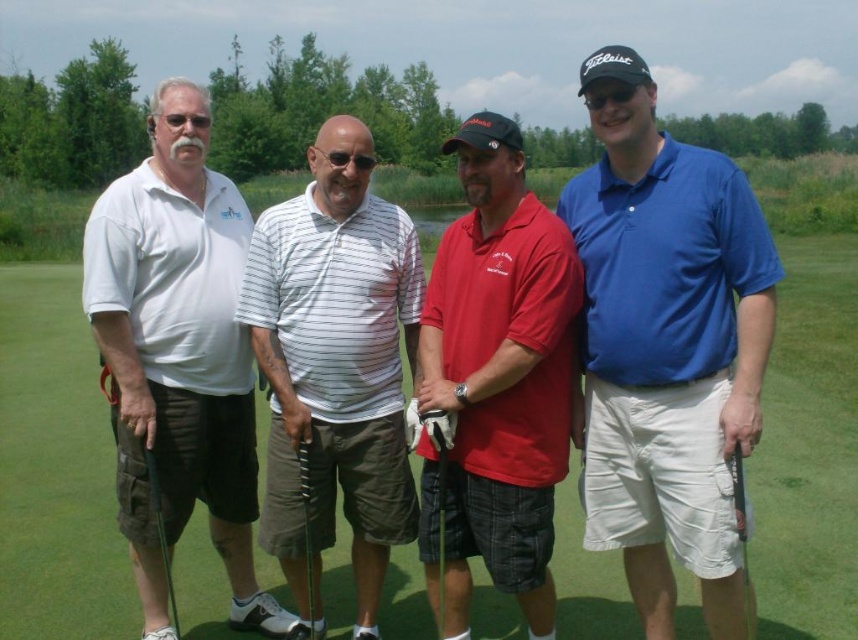
Based on the photo, you are a photographer trying to capture a closeup shot of the blue cotton polo shirt at center and the black metallic golf club at center. Which object should you zoom in on more to ensure both are in focus?

The blue cotton polo shirt at center is bigger than the black metallic golf club at center, so you should zoom in more on the black metallic golf club at center to ensure both are in focus.

You are a photographer trying to capture a clear shot of the blue cotton polo shirt at center and the black metallic golf club at center. Based on their positions, which one should you focus on first to ensure it is in the foreground?

The blue cotton polo shirt at center is located above the black metallic golf club at center, so focusing on the blue cotton polo shirt at center first will ensure it is in the foreground.